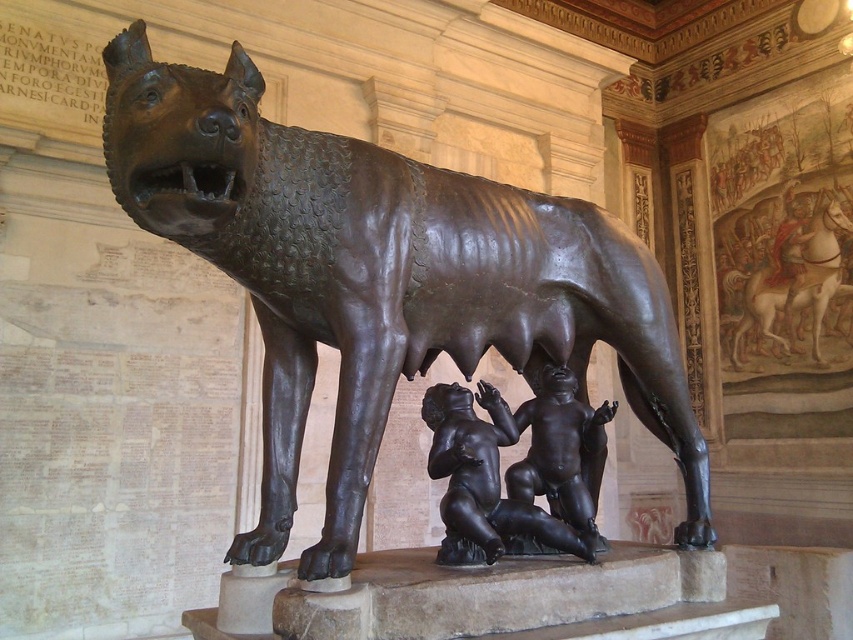
Question: Which of the following is the farthest from the observer?

Choices:
 (A) (734, 282)
 (B) (482, 436)

Answer: (A)

Question: Among these points, which one is farthest from the camera?

Choices:
 (A) (461, 390)
 (B) (833, 208)

Answer: (B)

Question: Is bronze textured wolf at center to the right of bronze horse at upper right from the viewer's perspective?

Choices:
 (A) yes
 (B) no

Answer: (B)

Question: Where is polished bronze twin figures at center located in relation to bronze horse at upper right in the image?

Choices:
 (A) below
 (B) above

Answer: (A)

Question: Where is bronze textured wolf at center located in relation to bronze horse at upper right in the image?

Choices:
 (A) below
 (B) above

Answer: (A)

Question: Among these objects, which one is nearest to the camera?

Choices:
 (A) bronze horse at upper right
 (B) polished bronze twin figures at center

Answer: (B)